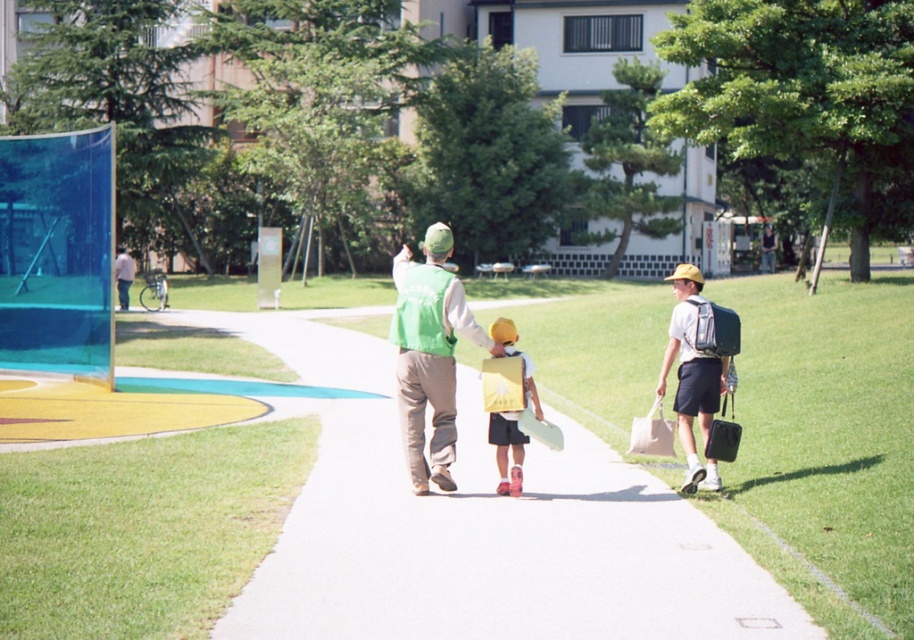
Question: Is white smooth pavement at center to the left of yellow matte backpack at center from the viewer's perspective?

Choices:
 (A) no
 (B) yes

Answer: (B)

Question: Which of the following is the farthest from the observer?

Choices:
 (A) white smooth pavement at center
 (B) matte green vest at center
 (C) green fabric vest at center

Answer: (B)

Question: Is white smooth pavement at center positioned in front of green fabric vest at center?

Choices:
 (A) no
 (B) yes

Answer: (B)

Question: Which object is farther from the camera taking this photo?

Choices:
 (A) matte green vest at center
 (B) light blue fabric shirt at left
 (C) yellow matte backpack at center
 (D) white smooth pavement at center

Answer: (B)

Question: Which of the following is the closest to the observer?

Choices:
 (A) light blue fabric shirt at left
 (B) white smooth pavement at center
 (C) matte green vest at center
 (D) green fabric vest at center

Answer: (B)

Question: Is white smooth pavement at center positioned in front of yellow matte backpack at center?

Choices:
 (A) yes
 (B) no

Answer: (A)